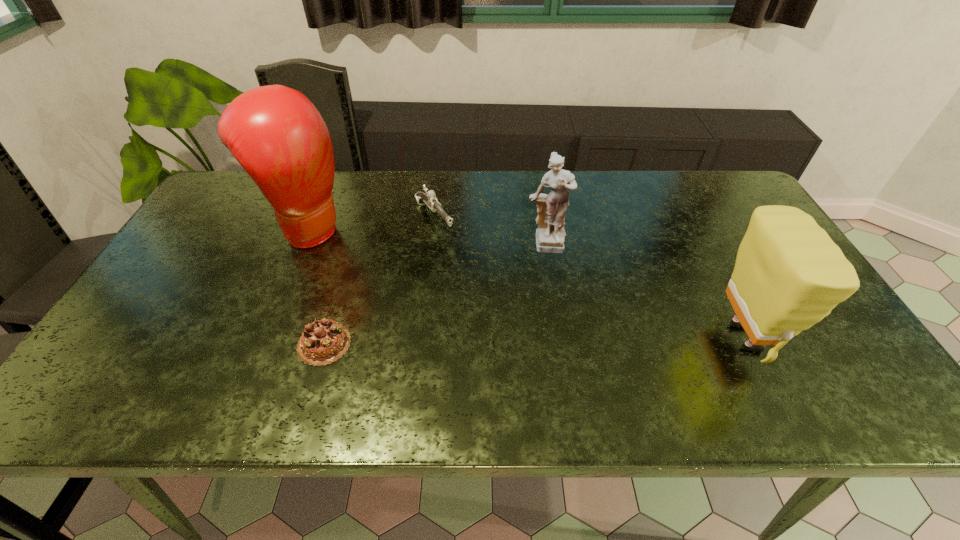
Where is `vacant space that satisfies the following two spatial constraints: 1. on the front side of the sponge; 2. on the face of the boxing glove`? The image size is (960, 540). vacant space that satisfies the following two spatial constraints: 1. on the front side of the sponge; 2. on the face of the boxing glove is located at coordinates (265, 337).